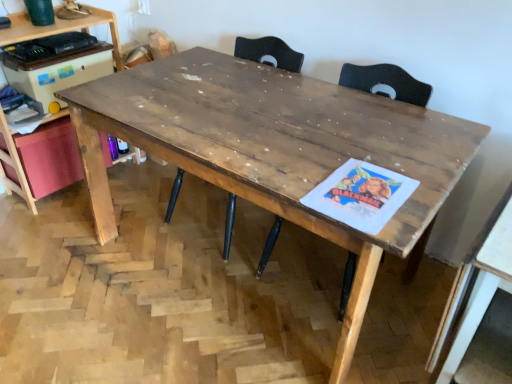
Image resolution: width=512 pixels, height=384 pixels. Identify the location of free point to the right of wooden computer desk at left. (137, 185).